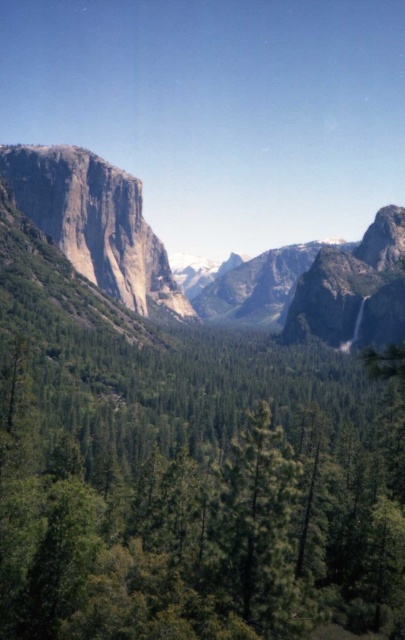
You are a hiker standing at the base of the rugged granite cliff at left and want to reach the green matte tree at center. Which direction should you move to get closer to the tree?

The green matte tree at center is located in the center of the image, so to reach it from the base of the rugged granite cliff at left, you should move towards the center from the left side.

You are an explorer standing at the edge of the valley looking towards the mountains. You see a green matte tree at center and a rugged granite cliff at left. Which object is positioned to the right of the other?

The green matte tree at center is positioned to the right of rugged granite cliff at left.